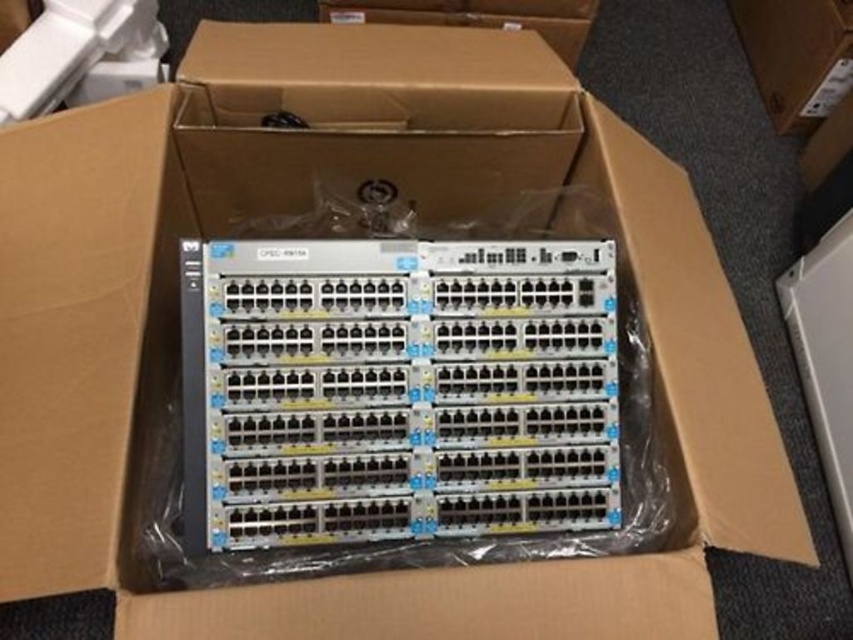
Consider the image. You are moving boxes in a warehouse and need to stack them efficiently. You see the cardboard box at center and the brown cardboard box at upper center. Which box should you place on top to ensure stability?

You should place the brown cardboard box at upper center on top of the cardboard box at center because the cardboard box at center is closer to you and can support the weight better due to its position being further away from the viewer, making it more stable.

You are moving boxes in a warehouse and need to stack them efficiently. You see the cardboard box at center and the brown cardboard box at upper center. Which box should you place on top to ensure stability?

The brown cardboard box at upper center should be placed on top of the cardboard box at center because it is positioned to the left, making it smaller and thus more stable when stacked.